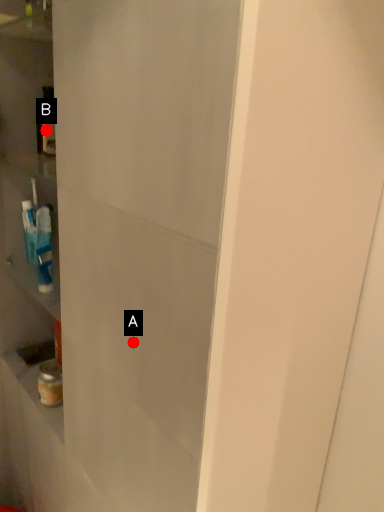
Question: Two points are circled on the image, labeled by A and B beside each circle. Which point is farther to the camera?

Choices:
 (A) A is further
 (B) B is further

Answer: (B)